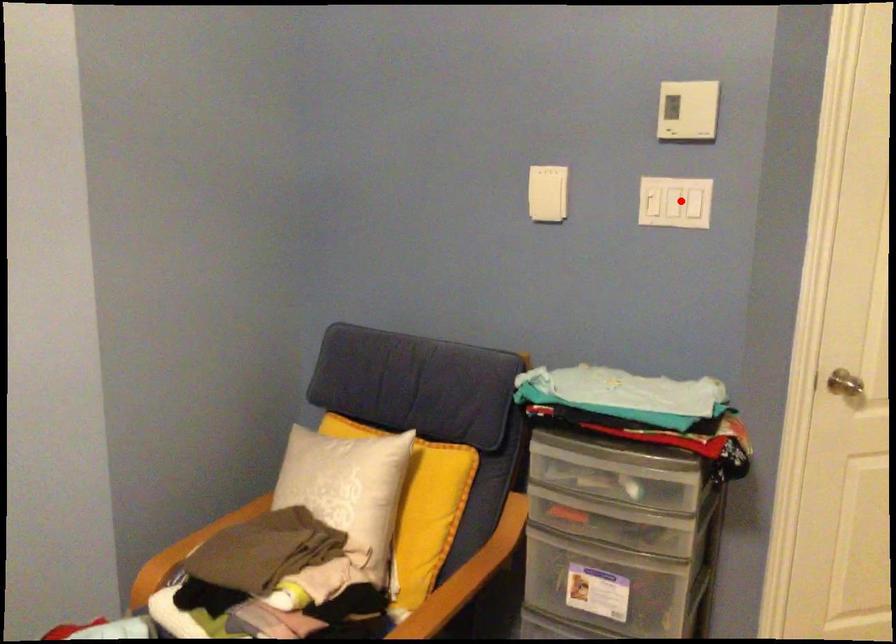
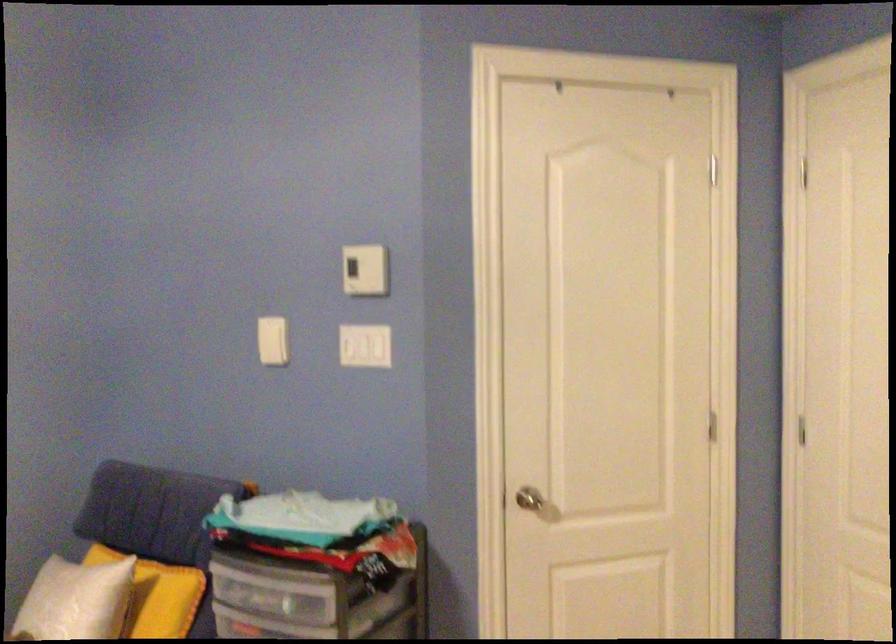
In the second image, find the point that corresponds to the highlighted location in the first image.

(365, 346)